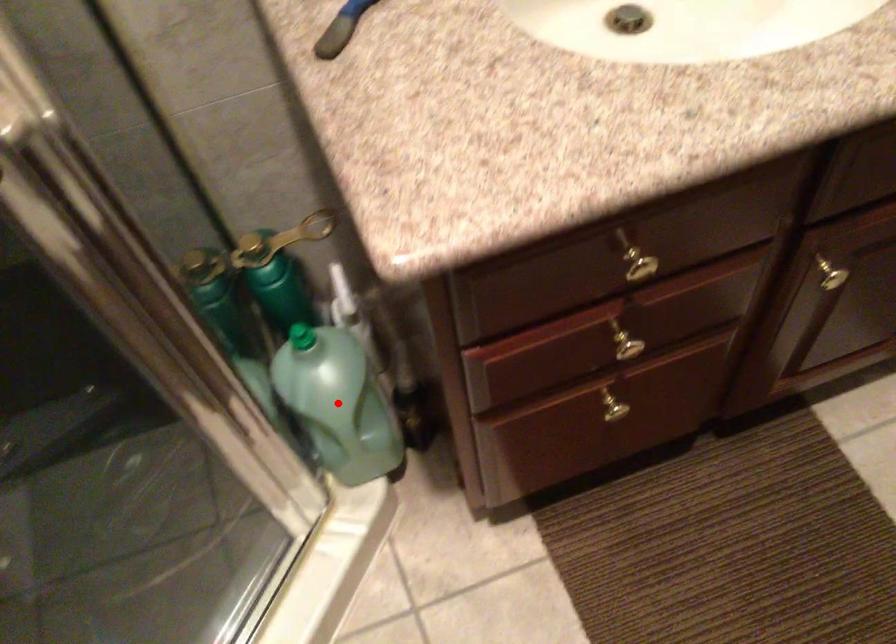
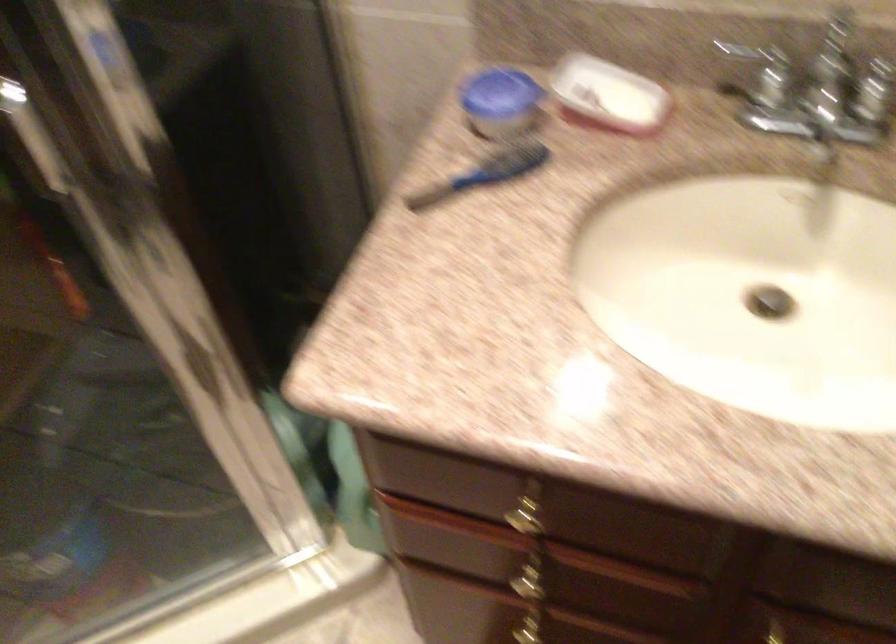
Question: I am providing you with two images of the same scene from different viewpoints. A red point is marked on the first image. Is the red point's position out of view in image 2?

Choices:
 (A) Yes
 (B) No

Answer: (A)